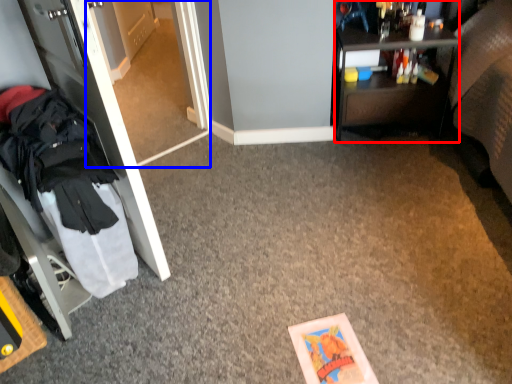
Question: Which point is further to the camera, desk (highlighted by a red box) or glass door (highlighted by a blue box)?

Choices:
 (A) desk
 (B) glass door

Answer: (A)